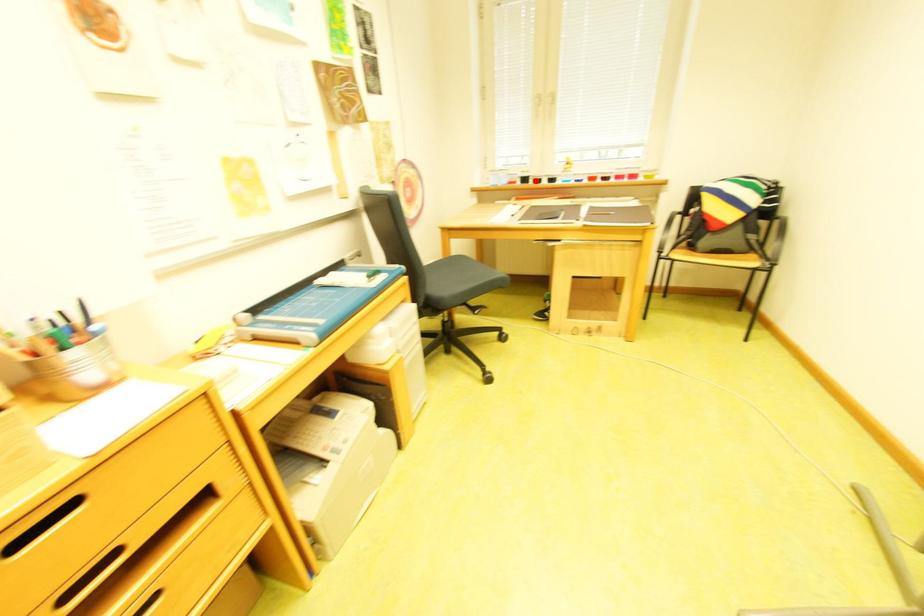
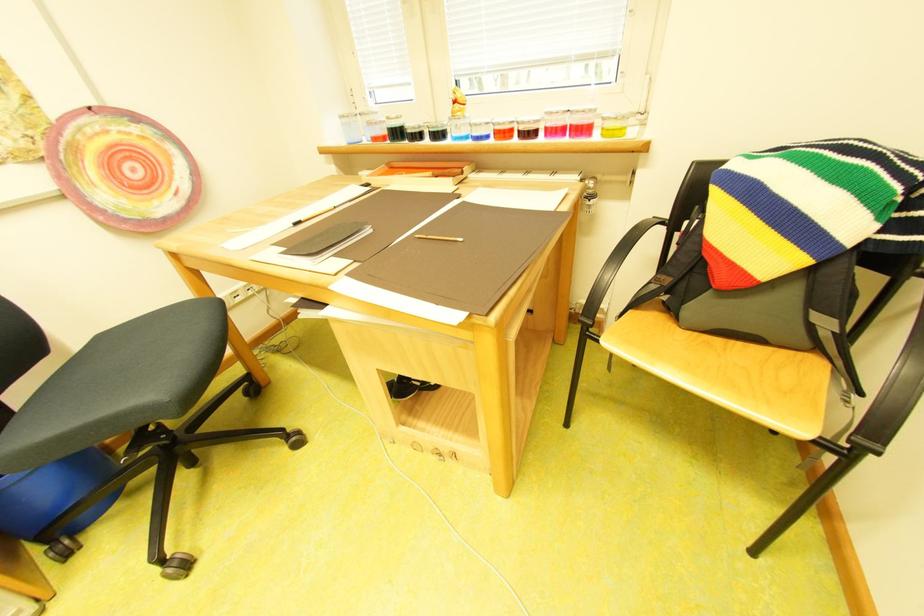
In the second image, find the point that corresponds to the highlighted location in the first image.

(407, 135)